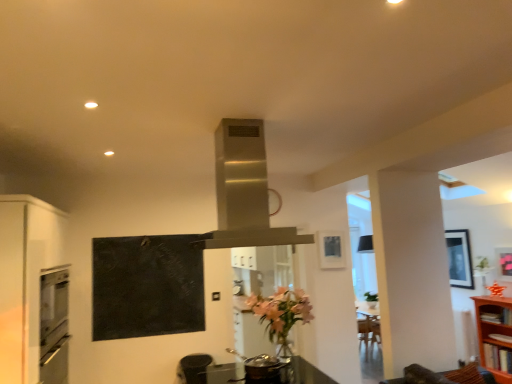
Question: Does brown wooden shelf at right, marked as the 2th shelf in a bottom-to-top arrangement, appear on the left side of wooden bookshelf at right, acting as the first shelf starting from the bottom?

Choices:
 (A) yes
 (B) no

Answer: (A)

Question: Does brown wooden shelf at right, the 1th shelf from the top, have a greater height compared to wooden bookshelf at right, which ranks as the second shelf in top-to-bottom order?

Choices:
 (A) no
 (B) yes

Answer: (A)

Question: Can you confirm if brown wooden shelf at right, marked as the 2th shelf in a bottom-to-top arrangement, is wider than wooden bookshelf at right, which ranks as the second shelf in top-to-bottom order?

Choices:
 (A) yes
 (B) no

Answer: (B)

Question: From a real-world perspective, is brown wooden shelf at right, the 1th shelf from the top, located higher than wooden bookshelf at right, which ranks as the second shelf in top-to-bottom order?

Choices:
 (A) yes
 (B) no

Answer: (A)

Question: Is brown wooden shelf at right, the 1th shelf from the top, facing away from wooden bookshelf at right, acting as the first shelf starting from the bottom?

Choices:
 (A) no
 (B) yes

Answer: (B)

Question: Looking at their shapes, would you say brown wooden shelf at right, marked as the 2th shelf in a bottom-to-top arrangement, is wider or thinner than black matte chalkboard at upper left?

Choices:
 (A) wide
 (B) thin

Answer: (A)

Question: Does point 500,309 appear closer or farther from the camera than point 140,292?

Choices:
 (A) farther
 (B) closer

Answer: (A)

Question: Relative to black matte chalkboard at upper left, is brown wooden shelf at right, the 1th shelf from the top, in front or behind?

Choices:
 (A) front
 (B) behind

Answer: (B)

Question: Visually, is brown wooden shelf at right, the 1th shelf from the top, positioned to the left or to the right of black matte chalkboard at upper left?

Choices:
 (A) left
 (B) right

Answer: (B)

Question: From a real-world perspective, is matte black picture frame at upper right, the 2th picture frame in the front-to-back sequence, positioned above or below wooden bookshelf at right, which ranks as the second shelf in top-to-bottom order?

Choices:
 (A) below
 (B) above

Answer: (B)

Question: Considering the positions of matte black picture frame at upper right, acting as the 1th picture frame starting from the right, and wooden bookshelf at right, acting as the first shelf starting from the bottom, in the image, is matte black picture frame at upper right, acting as the 1th picture frame starting from the right, taller or shorter than wooden bookshelf at right, acting as the first shelf starting from the bottom,?

Choices:
 (A) tall
 (B) short

Answer: (B)

Question: In the image, is matte black picture frame at upper right, acting as the 1th picture frame starting from the right, positioned in front of or behind wooden bookshelf at right, which ranks as the second shelf in top-to-bottom order?

Choices:
 (A) front
 (B) behind

Answer: (B)

Question: In the image, is matte black picture frame at upper right, acting as the 1th picture frame starting from the right, on the left side or the right side of wooden bookshelf at right, acting as the first shelf starting from the bottom?

Choices:
 (A) left
 (B) right

Answer: (B)

Question: Is point [111, 304] closer or farther from the camera than point [53, 360]?

Choices:
 (A) farther
 (B) closer

Answer: (A)

Question: Considering the positions of black matte chalkboard at upper left and matte white oven at left in the image, is black matte chalkboard at upper left taller or shorter than matte white oven at left?

Choices:
 (A) short
 (B) tall

Answer: (B)